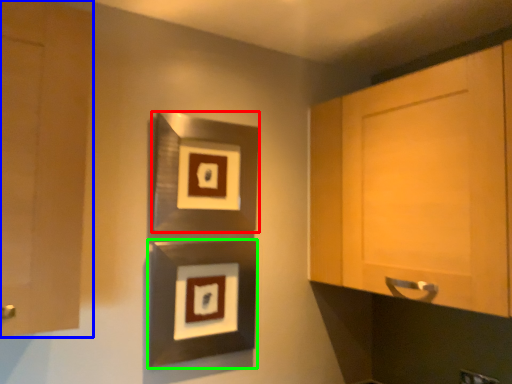
Question: Which object is the closest to the picture frame (highlighted by a red box)? Choose among these: cabinetry (highlighted by a blue box) or picture frame (highlighted by a green box).

Choices:
 (A) cabinetry
 (B) picture frame

Answer: (B)